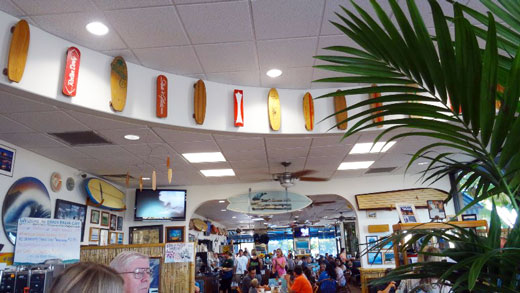
This screenshot has height=293, width=520. In order to click on wooden shelving unit in this screenshot , I will do `click(430, 227)`.